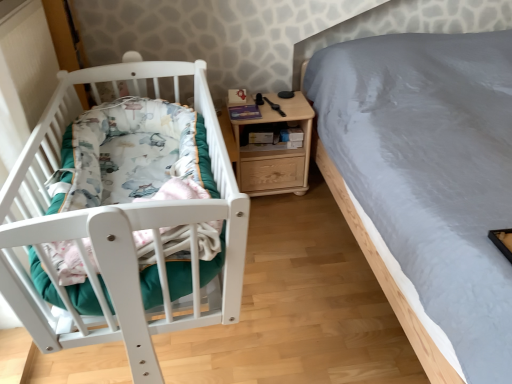
Question: Considering their positions, is white matte crib at left located in front of or behind light wood/texture nightstand at center?

Choices:
 (A) behind
 (B) front

Answer: (B)

Question: Is white matte crib at left bigger or smaller than light wood/texture nightstand at center?

Choices:
 (A) small
 (B) big

Answer: (B)

Question: Considering the positions of white matte crib at left and light wood/texture nightstand at center in the image, is white matte crib at left taller or shorter than light wood/texture nightstand at center?

Choices:
 (A) tall
 (B) short

Answer: (B)

Question: From their relative heights in the image, would you say light wood/texture nightstand at center is taller or shorter than white matte crib at left?

Choices:
 (A) short
 (B) tall

Answer: (B)

Question: From a real-world perspective, relative to white matte crib at left, is light wood/texture nightstand at center vertically above or below?

Choices:
 (A) below
 (B) above

Answer: (A)

Question: Relative to white matte crib at left, is light wood/texture nightstand at center in front or behind?

Choices:
 (A) behind
 (B) front

Answer: (A)

Question: Is point (269, 168) closer or farther from the camera than point (49, 168)?

Choices:
 (A) closer
 (B) farther

Answer: (B)